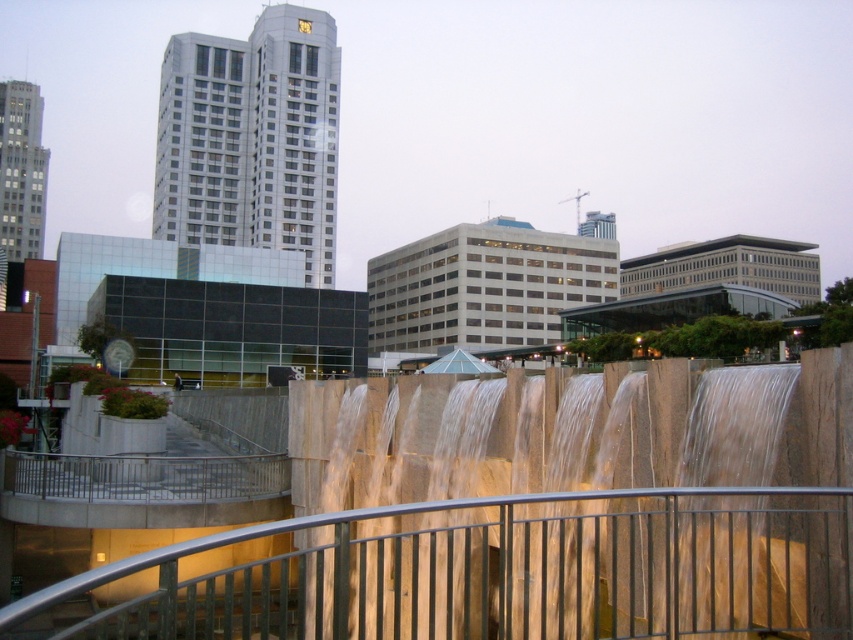
Question: Does smooth stone waterfall at center appear on the right side of metallic silver railing at lower center?

Choices:
 (A) no
 (B) yes

Answer: (B)

Question: Which point is closer to the camera?

Choices:
 (A) (751, 616)
 (B) (560, 614)

Answer: (A)

Question: In this image, where is smooth stone waterfall at center located relative to metallic silver railing at lower center?

Choices:
 (A) right
 (B) left

Answer: (A)

Question: Which object is closer to the camera taking this photo?

Choices:
 (A) smooth stone waterfall at center
 (B) metallic silver railing at lower center

Answer: (B)

Question: Does smooth stone waterfall at center have a smaller size compared to metallic silver railing at lower center?

Choices:
 (A) yes
 (B) no

Answer: (A)